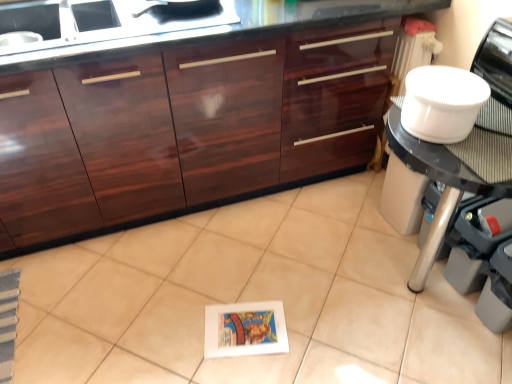
In order to click on blank space situated above white glossy tile at center (from a real-world perspective) in this screenshot , I will do `click(232, 311)`.